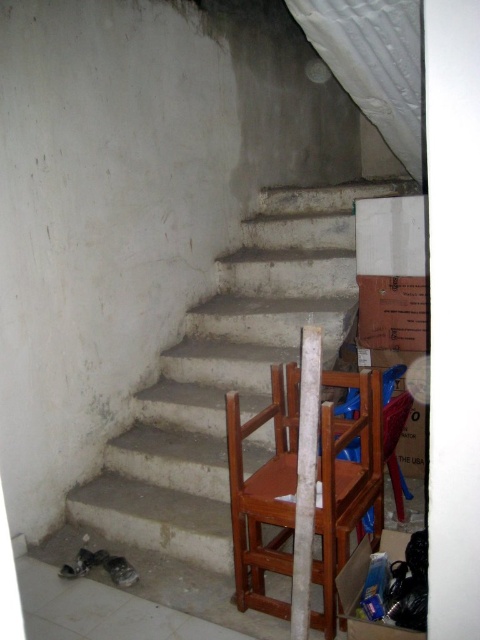
Who is positioned more to the left, white concrete stairs at center or brown wooden chair at right?

Positioned to the left is white concrete stairs at center.

Who is more distant from viewer, (255, 406) or (279, 470)?

Positioned behind is point (255, 406).

Is point (157, 397) closer to camera compared to point (285, 440)?

No, it is not.

What are the coordinates of `white concrete stairs at center` in the screenshot? It's located at (228, 372).